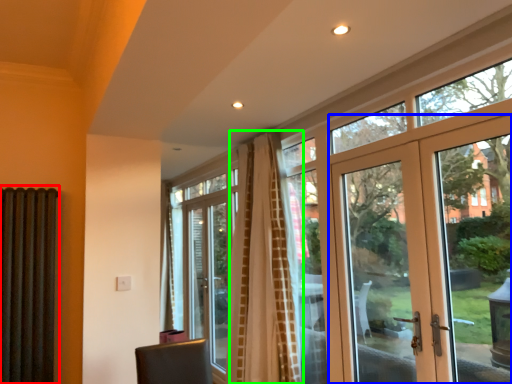
Question: Which object is positioned closest to shutter (highlighted by a red box)? Select from door (highlighted by a blue box) and curtain (highlighted by a green box).

Choices:
 (A) door
 (B) curtain

Answer: (B)